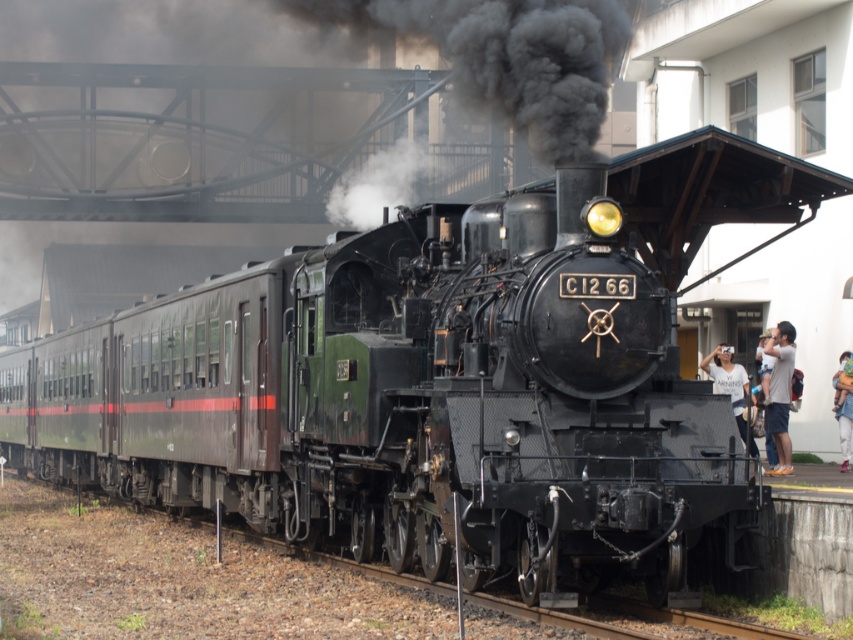
You are a passenger on the train and want to put your belongings in the overhead compartment. You have a white cotton shirt at center and light blue denim jeans at lower right. Which item is positioned higher relative to the other?

The white cotton shirt at center is located above the light blue denim jeans at lower right, so the white cotton shirt at center is positioned higher.

You are a photographer standing at the platform where the C12 66 steam locomotive is parked. You notice a white cotton shirt at center and light blue denim jeans at lower right in your viewfinder. Which clothing item is positioned more to the left in the image?

The white cotton shirt at center is positioned to the left of the light blue denim jeans at lower right, so the white cotton shirt at center is more to the left.